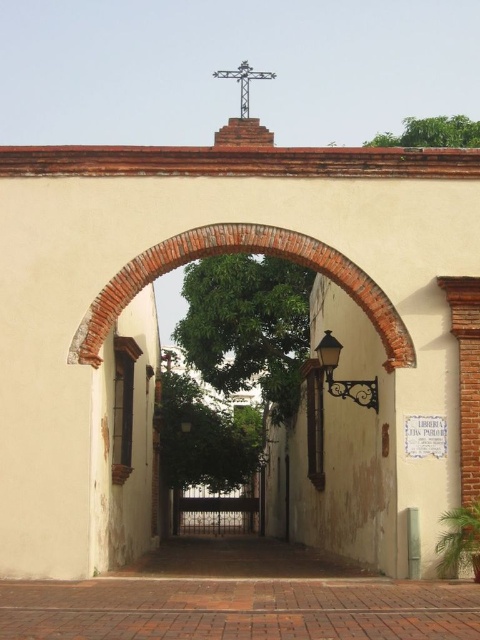
Which of these two, brick archway at center or matte black lamp at center, stands shorter?

matte black lamp at center is shorter.

Consider the image. Which is more to the left, brick archway at center or matte black lamp at center?

brick archway at center

Identify the location of brick archway at center. (248, 250).

Between brick at lower center and matte black lamp at center, which one appears on the right side from the viewer's perspective?

From the viewer's perspective, matte black lamp at center appears more on the right side.

Can you confirm if brick at lower center is positioned to the left of matte black lamp at center?

Indeed, brick at lower center is positioned on the left side of matte black lamp at center.

Locate an element on the screen. This screenshot has width=480, height=640. brick at lower center is located at coordinates pyautogui.click(x=239, y=609).

The height and width of the screenshot is (640, 480). In order to click on brick at lower center in this screenshot , I will do `click(239, 609)`.

Who is taller, brick at lower center or brick archway at center?

Standing taller between the two is brick archway at center.

Which is behind, point (154, 580) or point (276, 244)?

The point (154, 580) is behind.

Who is more distant from viewer, (408, 609) or (256, 244)?

Point (256, 244)

Image resolution: width=480 pixels, height=640 pixels. In order to click on brick at lower center in this screenshot , I will do `click(239, 609)`.